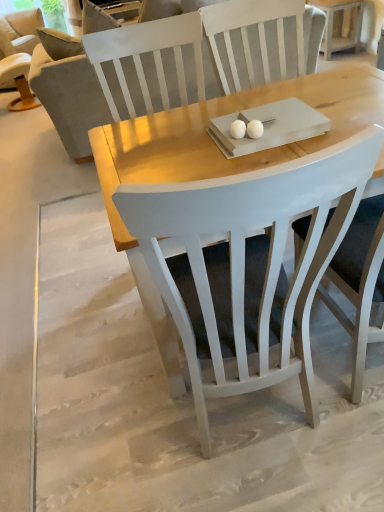
Find the location of `free spot to the left of gray fabric couch at left`. free spot to the left of gray fabric couch at left is located at coordinates (33, 153).